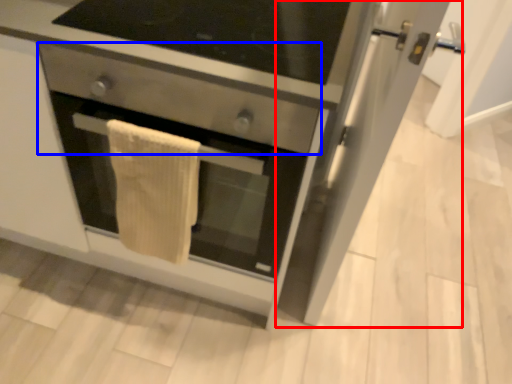
Question: Which object is closer to the camera taking this photo, glass door (highlighted by a red box) or drawer (highlighted by a blue box)?

Choices:
 (A) glass door
 (B) drawer

Answer: (A)